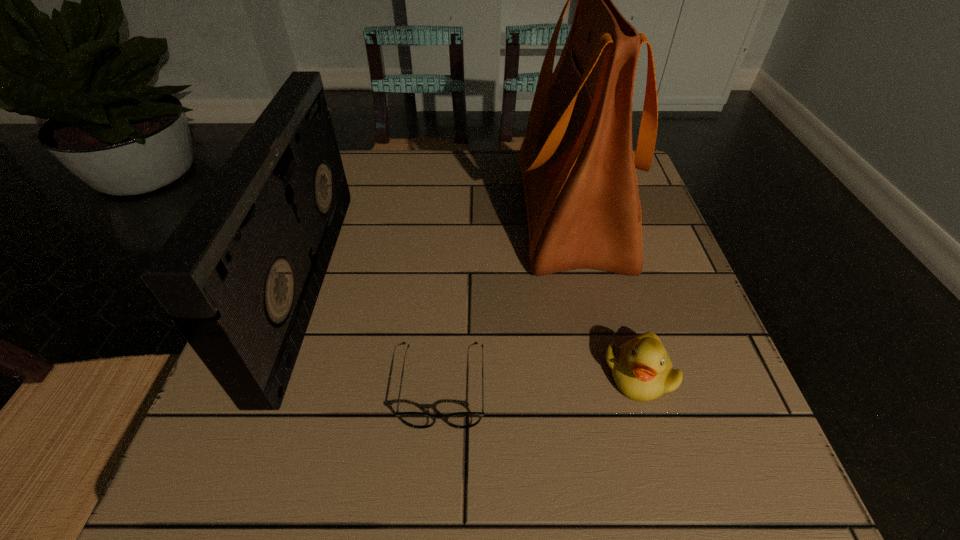
Locate an element on the screen. This screenshot has width=960, height=540. free spot located 0.150m on the front-facing side of the duckling is located at coordinates (677, 509).

At what (x,y) coordinates should I click in order to perform the action: click on free point located 0.080m through the lenses of the third object from right to left. Please return your answer as a coordinate pair (x, y). Image resolution: width=960 pixels, height=540 pixels. Looking at the image, I should click on (438, 486).

Locate an element on the screen. shopping bag at the far edge is located at coordinates (577, 164).

Where is `videotape at the far edge`? The width and height of the screenshot is (960, 540). videotape at the far edge is located at coordinates tap(241, 274).

Locate an element on the screen. This screenshot has width=960, height=540. object that is at the left edge is located at coordinates (241, 274).

Locate an element on the screen. Image resolution: width=960 pixels, height=540 pixels. shopping bag that is at the right edge is located at coordinates (577, 164).

The width and height of the screenshot is (960, 540). What are the coordinates of `duckling at the right edge` in the screenshot? It's located at (641, 368).

Locate an element on the screen. This screenshot has width=960, height=540. object that is positioned at the far left corner is located at coordinates (241, 274).

Find the location of a particular element. The height and width of the screenshot is (540, 960). object at the far right corner is located at coordinates (577, 164).

The width and height of the screenshot is (960, 540). Identify the location of free space at the far edge of the desktop. (426, 197).